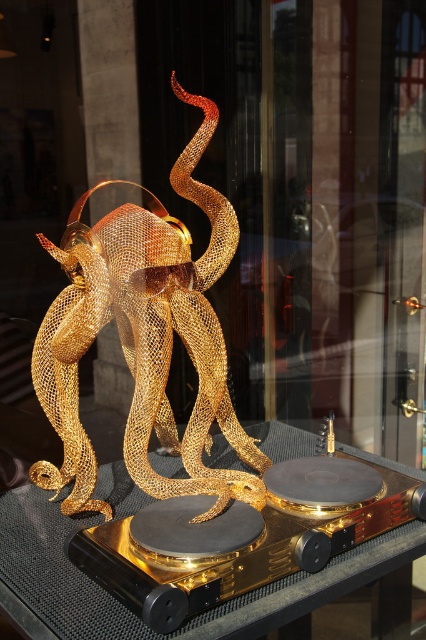
Does gold mesh octopus at center have a lesser height compared to transparent glass table at center?

No, gold mesh octopus at center is not shorter than transparent glass table at center.

Is gold mesh octopus at center further to camera compared to transparent glass table at center?

Yes, it is behind transparent glass table at center.

Where is `gold mesh octopus at center`? This screenshot has height=640, width=426. gold mesh octopus at center is located at coordinates (144, 337).